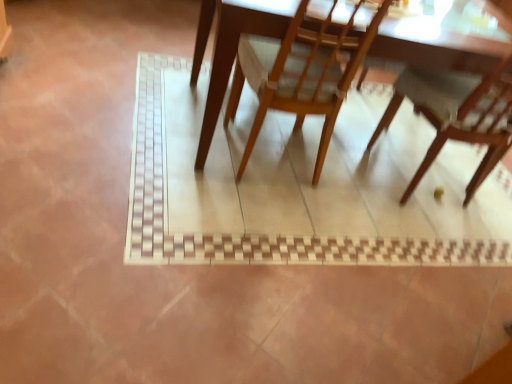
Question: From a real-world perspective, is wooden table at center over wooden chair at lower right, acting as the first chair starting from the right?

Choices:
 (A) yes
 (B) no

Answer: (B)

Question: Is wooden table at center to the right of wooden chair at lower right, which is the second chair from left to right, from the viewer's perspective?

Choices:
 (A) no
 (B) yes

Answer: (A)

Question: From the image's perspective, does wooden table at center appear higher than wooden chair at lower right, acting as the first chair starting from the right?

Choices:
 (A) yes
 (B) no

Answer: (A)

Question: Is wooden table at center shorter than wooden chair at lower right, which is the second chair from left to right?

Choices:
 (A) yes
 (B) no

Answer: (A)

Question: Considering the relative sizes of wooden table at center and wooden chair at lower right, acting as the first chair starting from the right, in the image provided, is wooden table at center bigger than wooden chair at lower right, acting as the first chair starting from the right,?

Choices:
 (A) no
 (B) yes

Answer: (B)

Question: From a real-world perspective, relative to wooden chair at lower right, acting as the first chair starting from the right, is wooden chair at center, the 1th chair from the left, vertically above or below?

Choices:
 (A) above
 (B) below

Answer: (B)

Question: Based on their sizes in the image, would you say wooden chair at center, the 1th chair from the left, is bigger or smaller than wooden chair at lower right, acting as the first chair starting from the right?

Choices:
 (A) small
 (B) big

Answer: (A)

Question: Is wooden chair at center, which ranks as the 2th chair in right-to-left order, taller or shorter than wooden chair at lower right, acting as the first chair starting from the right?

Choices:
 (A) short
 (B) tall

Answer: (A)

Question: In the image, is wooden chair at center, which ranks as the 2th chair in right-to-left order, positioned in front of or behind wooden chair at lower right, acting as the first chair starting from the right?

Choices:
 (A) behind
 (B) front

Answer: (B)

Question: In the image, is wooden chair at center, which ranks as the 2th chair in right-to-left order, on the left side or the right side of wooden table at center?

Choices:
 (A) left
 (B) right

Answer: (A)

Question: From a real-world perspective, is wooden chair at center, which ranks as the 2th chair in right-to-left order, above or below wooden table at center?

Choices:
 (A) below
 (B) above

Answer: (B)

Question: From the image's perspective, is wooden chair at center, the 1th chair from the left, positioned above or below wooden table at center?

Choices:
 (A) above
 (B) below

Answer: (B)

Question: Relative to wooden table at center, is wooden chair at center, the 1th chair from the left, in front or behind?

Choices:
 (A) behind
 (B) front

Answer: (B)

Question: From the image's perspective, is wooden table at center above or below wooden chair at lower right, which is the second chair from left to right?

Choices:
 (A) above
 (B) below

Answer: (A)

Question: Which is correct: wooden table at center is inside wooden chair at lower right, which is the second chair from left to right, or outside of it?

Choices:
 (A) outside
 (B) inside

Answer: (A)